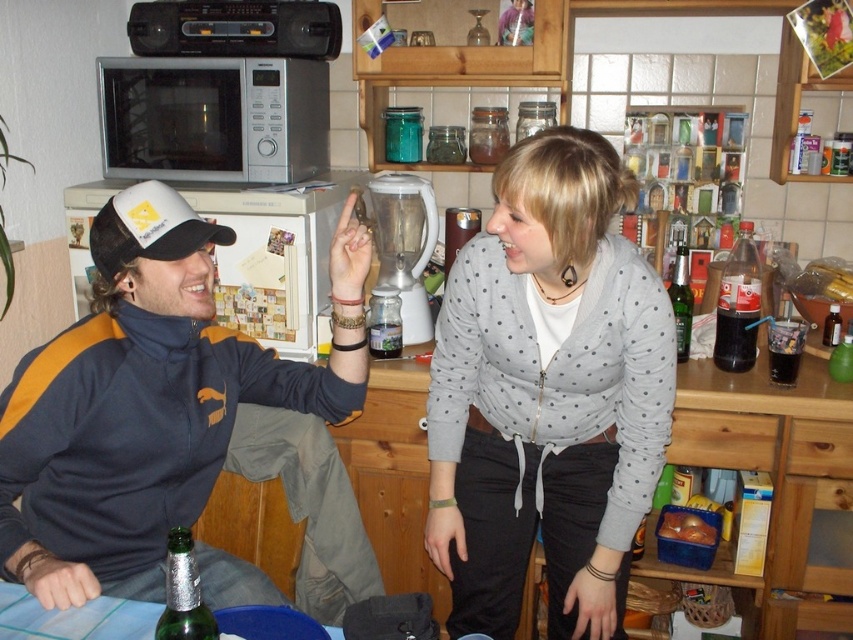
Can you confirm if white matte microwave at upper left is positioned below dark glass bottle at right?

Incorrect, white matte microwave at upper left is not positioned below dark glass bottle at right.

Between white matte microwave at upper left and dark glass bottle at right, which one appears on the left side from the viewer's perspective?

Positioned to the left is white matte microwave at upper left.

Is point (306, 208) less distant than point (749, 307)?

No, (306, 208) is further to viewer.

Where is `white matte microwave at upper left`? This screenshot has width=853, height=640. white matte microwave at upper left is located at coordinates (273, 259).

This screenshot has width=853, height=640. In order to click on green glass bottle at lower left in this screenshot , I will do `click(183, 593)`.

In the scene shown: Is green glass bottle at lower left further to camera compared to green glass bottle at center?

No.

What do you see at coordinates (183, 593) in the screenshot? I see `green glass bottle at lower left` at bounding box center [183, 593].

Identify the location of green glass bottle at lower left. (183, 593).

The height and width of the screenshot is (640, 853). What do you see at coordinates (148, 228) in the screenshot? I see `white mesh baseball cap at upper left` at bounding box center [148, 228].

The image size is (853, 640). What are the coordinates of `white mesh baseball cap at upper left` in the screenshot? It's located at (148, 228).